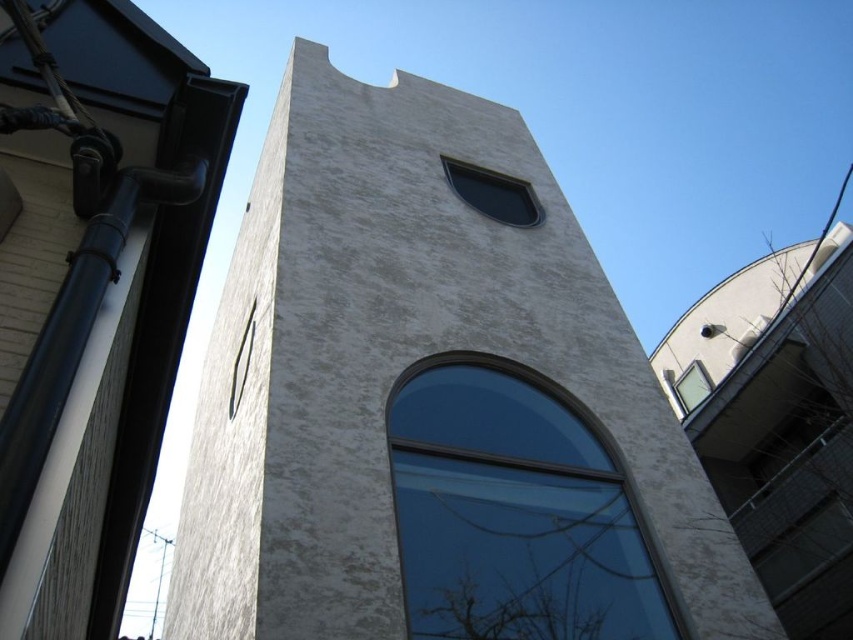
The width and height of the screenshot is (853, 640). What are the coordinates of `transparent glass window at center` in the screenshot? It's located at (514, 513).

Consider the image. Does transparent glass window at center lie behind transparent glass window at upper center?

That is False.

The width and height of the screenshot is (853, 640). What are the coordinates of `transparent glass window at center` in the screenshot? It's located at (514, 513).

Identify the location of transparent glass window at center. (514, 513).

Is transparent glass window at upper center below clear glass window at upper right?

No.

Does transparent glass window at upper center appear on the right side of clear glass window at upper right?

In fact, transparent glass window at upper center is to the left of clear glass window at upper right.

Which is in front, point (496, 192) or point (691, 369)?

Point (496, 192) is more forward.

Locate an element on the screen. The width and height of the screenshot is (853, 640). transparent glass window at upper center is located at coordinates (492, 193).

Can you confirm if white stucco tower at center is positioned to the left of metallic silver clock at upper left?

No, white stucco tower at center is not to the left of metallic silver clock at upper left.

Is white stucco tower at center smaller than metallic silver clock at upper left?

Yes.

Identify the location of white stucco tower at center. The width and height of the screenshot is (853, 640). (433, 403).